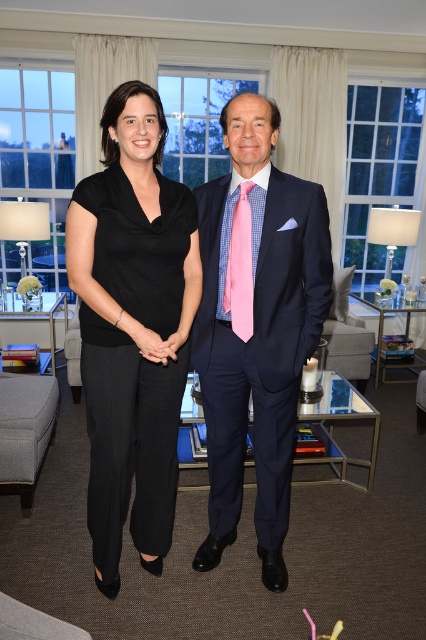
You are a photographer setting up a shoot in this living room. You need to place a 1.2 meter wide backdrop behind the two people. The backdrop must be positioned between the matte black dress at center and the gray fabric ottoman at lower left. Will the space between them be wide enough for the backdrop?

The matte black dress at center is wider than the gray fabric ottoman at lower left. However, the question is about the space between them, not their widths. The description provided does not specify the distance between the two objects, only their relative widths. Therefore, it is impossible to determine if the 1.2 meter backdrop will fit based on the given information.

You are a photographer setting up for a portrait in this living room. You want to position the matte black dress at center so that it aligns with the rule of thirds grid point at coordinate point (x=258, y=330). Is the current position of the matte black dress at center already aligned with that grid point?

The matte black dress at center is located at point (x=258, y=330), so yes, it is already aligned with the rule of thirds grid point at that coordinate.

You are taking a photo of the two points in the living room scene. Which point, point (321, 326) or point (0, 467), will appear larger in the photo?

Point (321, 326) is closer to the camera than point (0, 467), so it will appear larger in the photo.